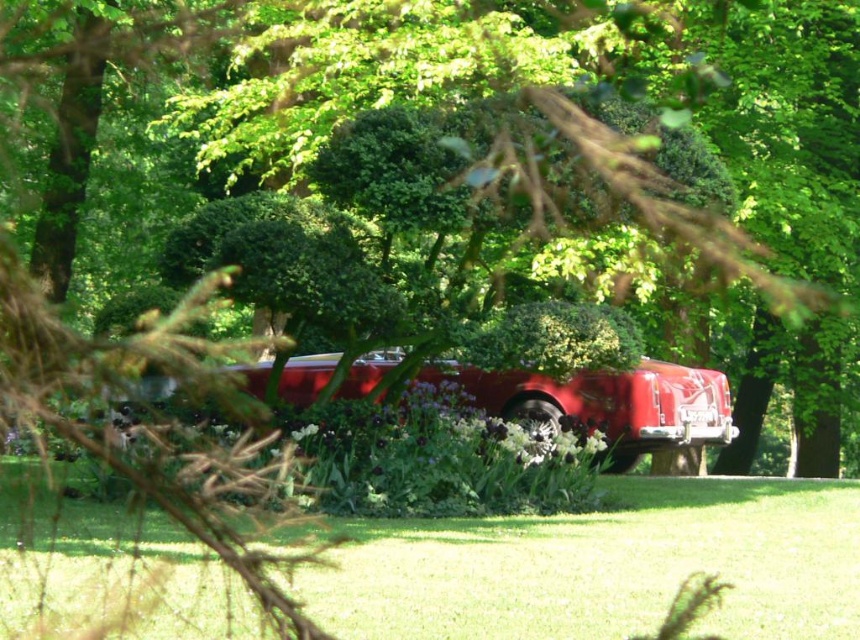
You are a photographer wanting to capture the glossy red car at center and the green leafy tree at center in a single shot. Based on their positions, which object would appear larger in the photo?

The green leafy tree at center appears larger in the photo because it is closer to the viewer than the glossy red car at center.

You are standing in the park where the vintage car is parked. You want to place a small decorative rock exactly at the center of the green grass at lower center. According to the image, what are the coordinates where you should place the rock?

The coordinates for the green grass at lower center are at point (603, 564), so you should place the rock there.

You are standing in the park and want to take a photo of the vibrant red vintage car parked in the garden. To ensure the green leafy tree at center is not blocking the view, where should you position yourself relative to the car?

The green leafy tree at center is located at point (602, 188), so you should position yourself on the side opposite to the tree to avoid it blocking the view of the car.